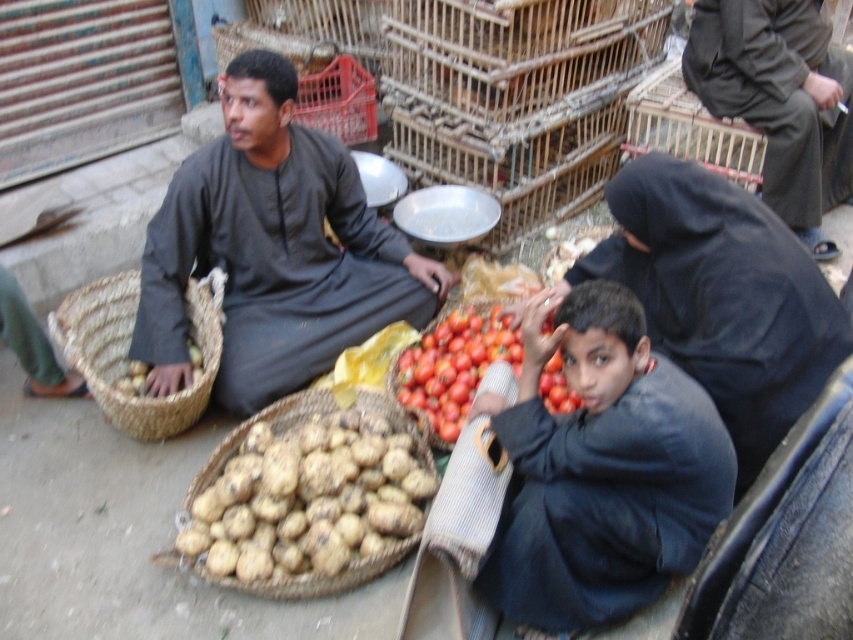
You are a customer at the market and want to compare the height of the ripe red tomato at center and the brown woven basket at lower left. Which one is taller?

The ripe red tomato at center has a lesser height compared to brown woven basket at lower left, so the brown woven basket at lower left is taller.

You are a customer at the market and want to place the ripe red tomato at center into the brown woven basket at lower left. Can you do this without moving either object?

The ripe red tomato at center and brown woven basket at lower left are 13.55 inches apart, so you can place the ripe red tomato at center into the brown woven basket at lower left without moving either object since the distance is manageable.

You are standing in the market and want to place a small item on the point that is closer to you. Which point should you choose between point (776, 104) and point (341, 129)?

You should choose point (776, 104) because it is closer to you than point (341, 129).